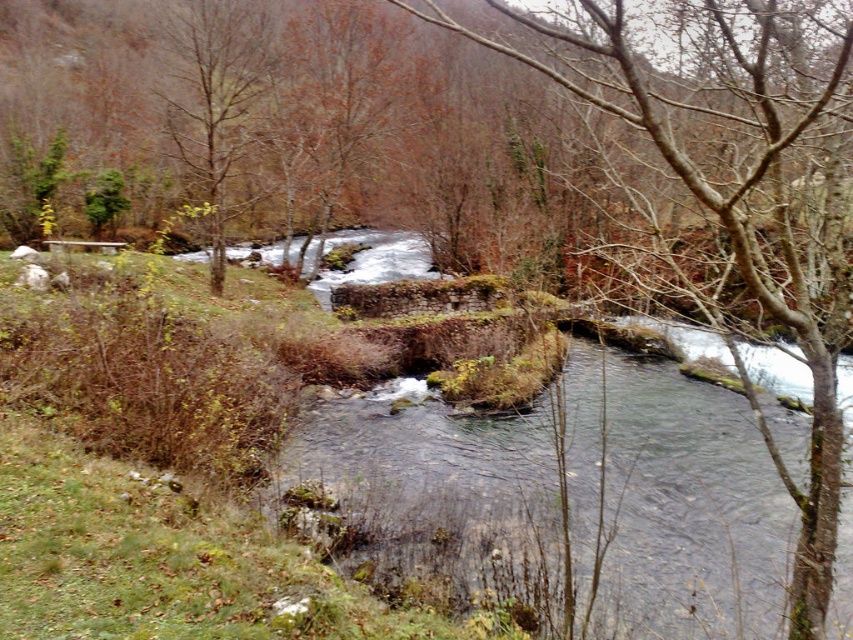
Is bare branches at center to the left of brown leafy tree at upper center from the viewer's perspective?

In fact, bare branches at center is to the right of brown leafy tree at upper center.

Does point (698, 252) come in front of point (350, 77)?

Yes, it is in front of point (350, 77).

The width and height of the screenshot is (853, 640). In order to click on bare branches at center in this screenshot , I will do `click(735, 189)`.

How much distance is there between brown leafy tree at upper center and brown leafless tree at upper left?

3.19 meters

The width and height of the screenshot is (853, 640). What are the coordinates of `brown leafy tree at upper center` in the screenshot? It's located at (334, 104).

Is point (376, 67) positioned before point (219, 147)?

No, it is not.

Where is `brown leafy tree at upper center`? This screenshot has width=853, height=640. brown leafy tree at upper center is located at coordinates (334, 104).

Which of these two, bare branches at center or brown leafless tree at upper left, stands shorter?

brown leafless tree at upper left is shorter.

Does bare branches at center come in front of brown leafless tree at upper left?

Yes, it is in front of brown leafless tree at upper left.

Between point (804, 20) and point (265, 10), which one is positioned in front?

Point (804, 20)

Where is `bare branches at center`? The image size is (853, 640). bare branches at center is located at coordinates (735, 189).